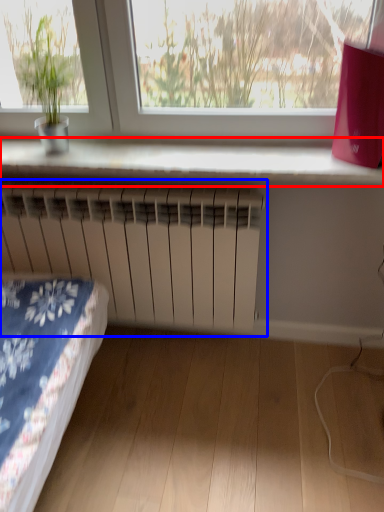
Question: Which object appears farthest to the camera in this image, window sill (highlighted by a red box) or radiator (highlighted by a blue box)?

Choices:
 (A) window sill
 (B) radiator

Answer: (B)